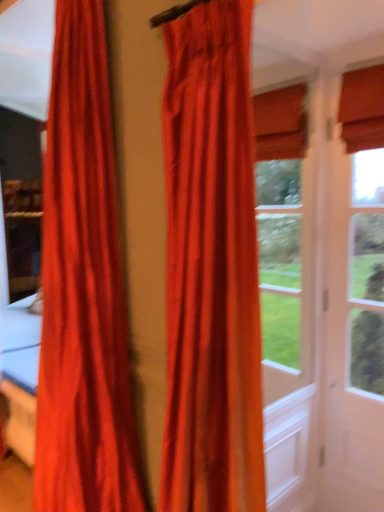
Describe the element at coordinates (83, 289) in the screenshot. I see `satin orange curtain at left, marked as the first curtain in a left-to-right arrangement` at that location.

This screenshot has height=512, width=384. What do you see at coordinates (211, 267) in the screenshot?
I see `satin-like red curtain at center, which appears as the 2th curtain when viewed from the left` at bounding box center [211, 267].

What do you see at coordinates (349, 316) in the screenshot? I see `matte white screen door at right` at bounding box center [349, 316].

I want to click on satin orange curtain at left, marked as the first curtain in a left-to-right arrangement, so click(83, 289).

Is matte white screen door at right thinner than satin-like red curtain at center, the first curtain positioned from the right?

Indeed, matte white screen door at right has a lesser width compared to satin-like red curtain at center, the first curtain positioned from the right.

From a real-world perspective, relative to satin-like red curtain at center, the first curtain positioned from the right, is matte white screen door at right vertically above or below?

Clearly, from a real-world perspective, matte white screen door at right is below satin-like red curtain at center, the first curtain positioned from the right.

How many degrees apart are the facing directions of matte white screen door at right and satin-like red curtain at center, the first curtain positioned from the right?

They differ by 0.806 degrees in their facing directions.

Is matte white screen door at right taller or shorter than satin-like red curtain at center, which appears as the 2th curtain when viewed from the left?

matte white screen door at right is taller than satin-like red curtain at center, which appears as the 2th curtain when viewed from the left.

In the image, is satin orange curtain at left, marked as the first curtain in a left-to-right arrangement, positioned in front of or behind matte white screen door at right?

Clearly, satin orange curtain at left, marked as the first curtain in a left-to-right arrangement, is in front of matte white screen door at right.

Based on the photo, from the image's perspective, between satin orange curtain at left, which is the 2th curtain in right-to-left order, and matte white screen door at right, which one is located above?

satin orange curtain at left, which is the 2th curtain in right-to-left order, appears higher in the image.

Based on the photo, is there a large distance between satin orange curtain at left, marked as the first curtain in a left-to-right arrangement, and matte white screen door at right?

Absolutely, satin orange curtain at left, marked as the first curtain in a left-to-right arrangement, is distant from matte white screen door at right.

From the picture: Considering the relative sizes of satin orange curtain at left, marked as the first curtain in a left-to-right arrangement, and matte white screen door at right in the image provided, is satin orange curtain at left, marked as the first curtain in a left-to-right arrangement, shorter than matte white screen door at right?

Incorrect, the height of satin orange curtain at left, marked as the first curtain in a left-to-right arrangement, does not fall short of that of matte white screen door at right.

Is matte white screen door at right further to camera compared to satin orange curtain at left, marked as the first curtain in a left-to-right arrangement?

Yes, matte white screen door at right is behind satin orange curtain at left, marked as the first curtain in a left-to-right arrangement.

Between matte white screen door at right and satin orange curtain at left, marked as the first curtain in a left-to-right arrangement, which one appears on the left side from the viewer's perspective?

satin orange curtain at left, marked as the first curtain in a left-to-right arrangement.

Based on the photo, is matte white screen door at right bigger than satin orange curtain at left, which is the 2th curtain in right-to-left order?

Incorrect, matte white screen door at right is not larger than satin orange curtain at left, which is the 2th curtain in right-to-left order.

Is point (378, 298) more distant than point (63, 152)?

Yes, point (378, 298) is farther from viewer.

How distant is satin-like red curtain at center, the first curtain positioned from the right, from satin orange curtain at left, marked as the first curtain in a left-to-right arrangement?

satin-like red curtain at center, the first curtain positioned from the right, and satin orange curtain at left, marked as the first curtain in a left-to-right arrangement, are 18.01 inches apart.

Between satin-like red curtain at center, the first curtain positioned from the right, and satin orange curtain at left, which is the 2th curtain in right-to-left order, which one appears on the left side from the viewer's perspective?

Positioned to the left is satin orange curtain at left, which is the 2th curtain in right-to-left order.

From a real-world perspective, is satin-like red curtain at center, the first curtain positioned from the right, under satin orange curtain at left, marked as the first curtain in a left-to-right arrangement?

Incorrect, from a real-world perspective, satin-like red curtain at center, the first curtain positioned from the right, is higher than satin orange curtain at left, marked as the first curtain in a left-to-right arrangement.

Considering the relative sizes of satin orange curtain at left, which is the 2th curtain in right-to-left order, and satin-like red curtain at center, which appears as the 2th curtain when viewed from the left, in the image provided, is satin orange curtain at left, which is the 2th curtain in right-to-left order, thinner than satin-like red curtain at center, which appears as the 2th curtain when viewed from the left,?

In fact, satin orange curtain at left, which is the 2th curtain in right-to-left order, might be wider than satin-like red curtain at center, which appears as the 2th curtain when viewed from the left.

How different are the orientations of satin orange curtain at left, marked as the first curtain in a left-to-right arrangement, and satin-like red curtain at center, the first curtain positioned from the right, in degrees?

They differ by 1.2 degrees in their facing directions.

Visually, is satin orange curtain at left, marked as the first curtain in a left-to-right arrangement, positioned to the left or to the right of satin-like red curtain at center, which appears as the 2th curtain when viewed from the left?

In the image, satin orange curtain at left, marked as the first curtain in a left-to-right arrangement, appears on the left side of satin-like red curtain at center, which appears as the 2th curtain when viewed from the left.

Would you consider satin orange curtain at left, which is the 2th curtain in right-to-left order, to be distant from satin-like red curtain at center, the first curtain positioned from the right?

No, satin orange curtain at left, which is the 2th curtain in right-to-left order, is not far away from satin-like red curtain at center, the first curtain positioned from the right.

Which of these two, satin-like red curtain at center, which appears as the 2th curtain when viewed from the left, or matte white screen door at right, stands shorter?

satin-like red curtain at center, which appears as the 2th curtain when viewed from the left.

Looking at this image, does satin-like red curtain at center, the first curtain positioned from the right, have a greater width compared to matte white screen door at right?

Indeed, satin-like red curtain at center, the first curtain positioned from the right, has a greater width compared to matte white screen door at right.

Is point (218, 14) farther from viewer compared to point (362, 237)?

No, it is in front of (362, 237).

Considering their positions, is satin-like red curtain at center, the first curtain positioned from the right, located in front of or behind matte white screen door at right?

Visually, satin-like red curtain at center, the first curtain positioned from the right, is located in front of matte white screen door at right.

Locate an element on the screen. screen door behind the satin-like red curtain at center, the first curtain positioned from the right is located at coordinates (349, 316).

The height and width of the screenshot is (512, 384). Identify the location of the 2nd curtain to the left of the matte white screen door at right, starting your count from the anchor. (83, 289).

From the picture: Estimate the real-world distances between objects in this image. Which object is further from matte white screen door at right, satin-like red curtain at center, the first curtain positioned from the right, or satin orange curtain at left, which is the 2th curtain in right-to-left order?

satin orange curtain at left, which is the 2th curtain in right-to-left order.

When comparing their distances from satin orange curtain at left, which is the 2th curtain in right-to-left order, does satin-like red curtain at center, the first curtain positioned from the right, or matte white screen door at right seem closer?

Among the two, satin-like red curtain at center, the first curtain positioned from the right, is located nearer to satin orange curtain at left, which is the 2th curtain in right-to-left order.

Considering their positions, is matte white screen door at right positioned closer to satin-like red curtain at center, the first curtain positioned from the right, than satin orange curtain at left, which is the 2th curtain in right-to-left order?

satin orange curtain at left, which is the 2th curtain in right-to-left order, lies closer to satin-like red curtain at center, the first curtain positioned from the right, than the other object.

Which object lies nearer to the anchor point satin-like red curtain at center, the first curtain positioned from the right, satin orange curtain at left, which is the 2th curtain in right-to-left order, or matte white screen door at right?

satin orange curtain at left, which is the 2th curtain in right-to-left order.

From the image, which object appears to be farther from matte white screen door at right, satin orange curtain at left, marked as the first curtain in a left-to-right arrangement, or satin-like red curtain at center, the first curtain positioned from the right?

The object further to matte white screen door at right is satin orange curtain at left, marked as the first curtain in a left-to-right arrangement.

Estimate the real-world distances between objects in this image. Which object is further from satin orange curtain at left, which is the 2th curtain in right-to-left order, matte white screen door at right or satin-like red curtain at center, which appears as the 2th curtain when viewed from the left?

matte white screen door at right.

At what (x,y) coordinates should I click in order to perform the action: click on curtain between satin orange curtain at left, marked as the first curtain in a left-to-right arrangement, and matte white screen door at right. Please return your answer as a coordinate pair (x, y). Looking at the image, I should click on (211, 267).